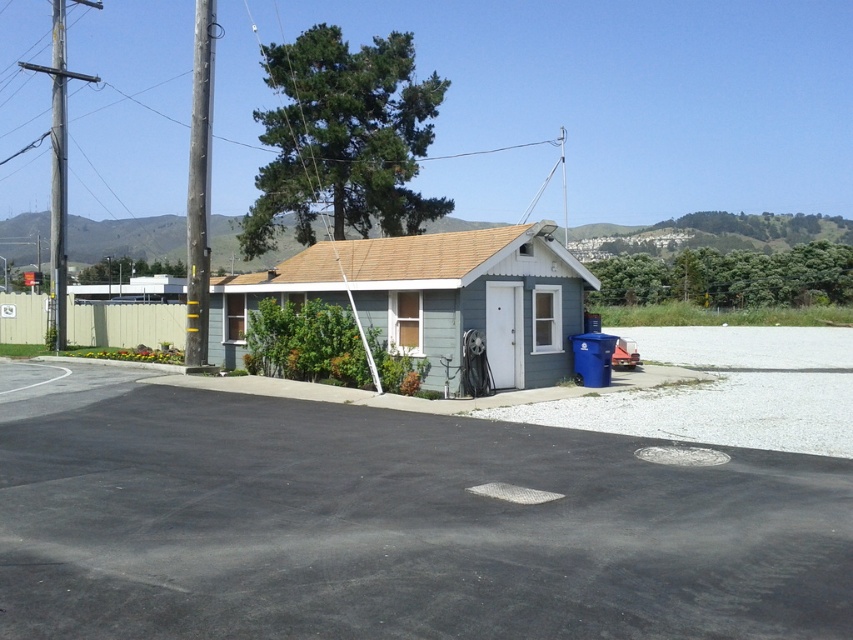
Consider the image. You are a painter who needs to paint the light blue siding at center and the brushed metal utility pole at left. Which one will require a taller ladder?

The brushed metal utility pole at left is taller than the light blue siding at center, so you will need a taller ladder for the brushed metal utility pole at left.

You are driving a car and want to park near the house. The black asphalt parking lot at lower left and the brushed metal utility pole at left are visible. Which object is closer to the house?

The black asphalt parking lot at lower left is positioned under the brushed metal utility pole at left, so the parking lot is closer to the house than the utility pole.